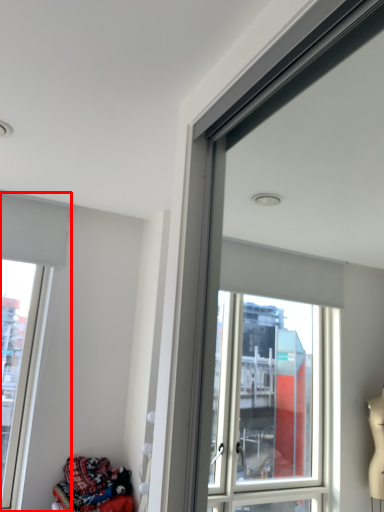
Question: From the image's perspective, where is window (annotated by the red box) located relative to clothing?

Choices:
 (A) above
 (B) below

Answer: (A)